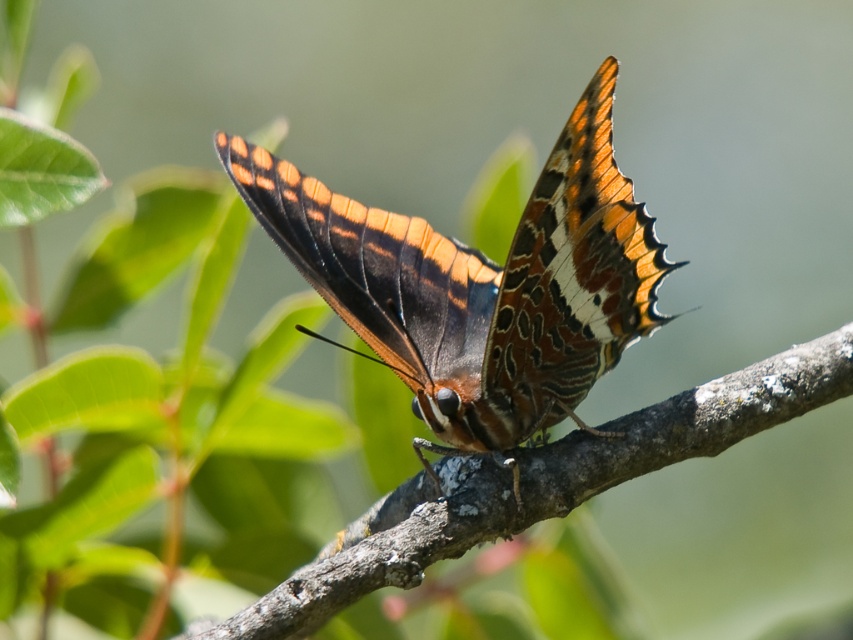
Question: Can you confirm if shiny orange butterfly at center is positioned above brown rough tree branch at center?

Choices:
 (A) yes
 (B) no

Answer: (A)

Question: Which object is farther from the camera taking this photo?

Choices:
 (A) brown rough tree branch at center
 (B) shiny orange butterfly at center

Answer: (B)

Question: Which object is farther from the camera taking this photo?

Choices:
 (A) shiny orange butterfly at center
 (B) brown rough tree branch at center

Answer: (A)

Question: Which point is closer to the camera?

Choices:
 (A) (322, 275)
 (B) (596, 492)

Answer: (B)

Question: Can you confirm if shiny orange butterfly at center is positioned to the right of brown rough tree branch at center?

Choices:
 (A) yes
 (B) no

Answer: (B)

Question: Is shiny orange butterfly at center thinner than brown rough tree branch at center?

Choices:
 (A) yes
 (B) no

Answer: (A)